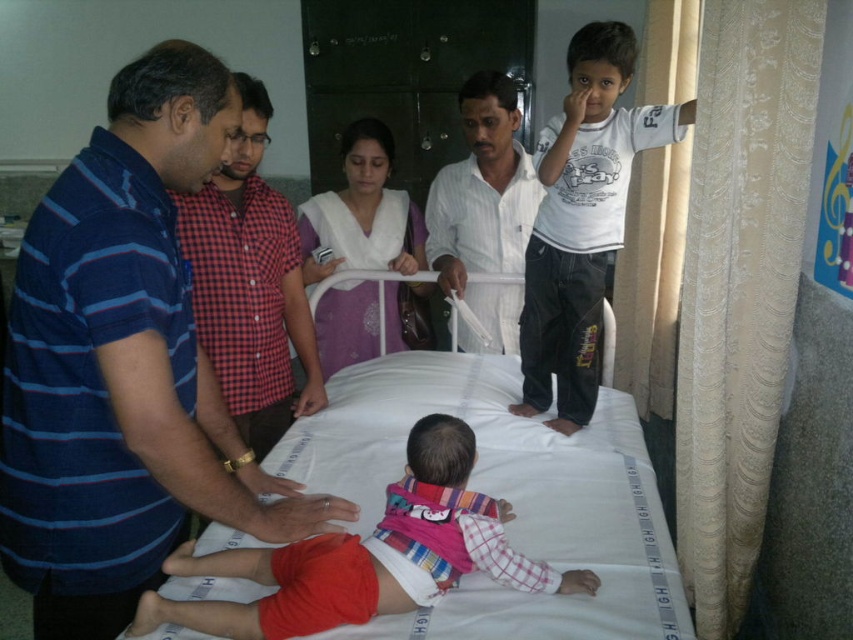
From the picture: You are a nurse in the hospital room and need to quickly reach the blue striped shirt at center and the white striped shirt at center to give them instructions. Which one can you reach first without moving your position?

The blue striped shirt at center is closer to the viewer than the white striped shirt at center, so you can reach the blue striped shirt at center first without moving your position.

You are a nurse in the hospital room and need to locate the blue striped shirt at left and the white cotton shirt at upper right. Which shirt is closer to the baby lying on the bed?

The white cotton shirt at upper right is closer to the baby because the blue striped shirt at left is behind it, meaning the white cotton shirt is in front and nearer to the baby.

You are a nurse in the hospital room. You need to hand a medical chart to both the blue striped shirt at center and the white striped shirt at center. Which one will you reach first if you are standing at the foot of the bed?

The blue striped shirt at center is much taller than the white striped shirt at center, so you will reach the blue striped shirt at center first because they are closer in height to you.